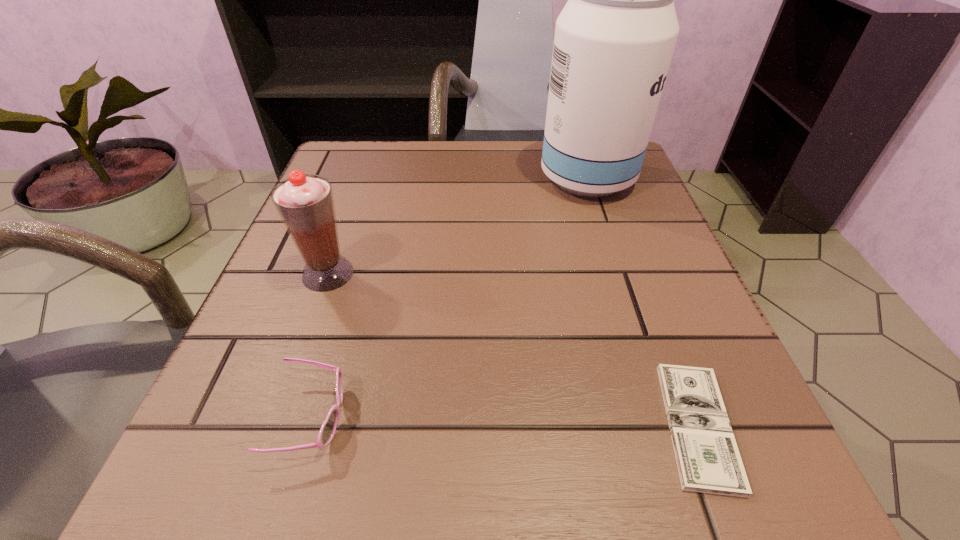
What are the coordinates of `object located at the far edge` in the screenshot? It's located at (614, 39).

Locate an element on the screen. This screenshot has height=540, width=960. sunglasses present at the near edge is located at coordinates (328, 429).

Locate an element on the screen. The height and width of the screenshot is (540, 960). dollar located at the near edge is located at coordinates (708, 460).

Find the location of a particular element. smoothie present at the left edge is located at coordinates (305, 203).

The height and width of the screenshot is (540, 960). I want to click on sunglasses that is positioned at the left edge, so click(x=328, y=429).

Identify the location of alcohol at the right edge. (614, 39).

Find the location of a particular element. dollar located at the right edge is located at coordinates (708, 460).

The image size is (960, 540). I want to click on object located at the near left corner, so (328, 429).

Image resolution: width=960 pixels, height=540 pixels. Find the location of `object located in the far right corner section of the desktop`. object located in the far right corner section of the desktop is located at coordinates (614, 39).

Locate an element on the screen. This screenshot has height=540, width=960. object at the near right corner is located at coordinates (708, 460).